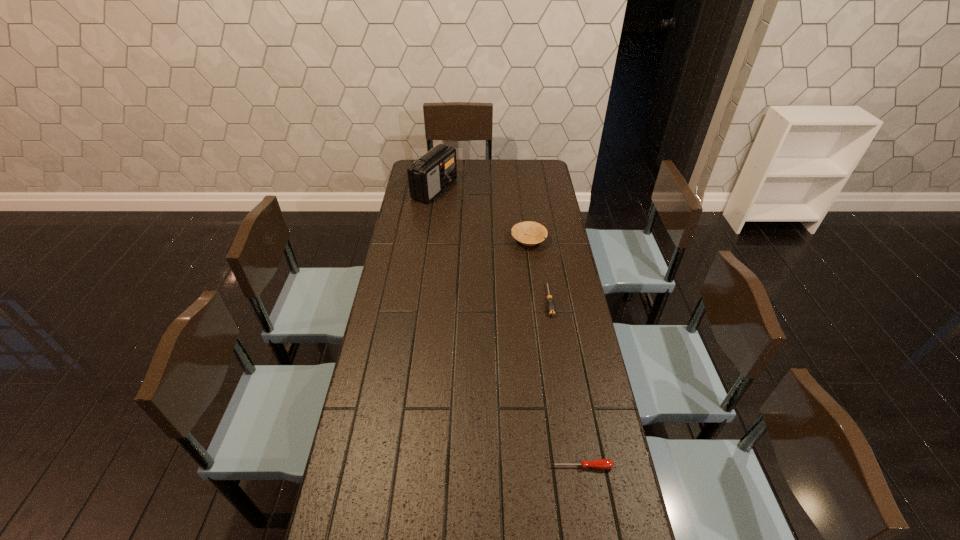
Identify the location of free region that satisfies the following two spatial constraints: 1. on the front panel of the tallest object; 2. on the right side of the third farthest object. (419, 300).